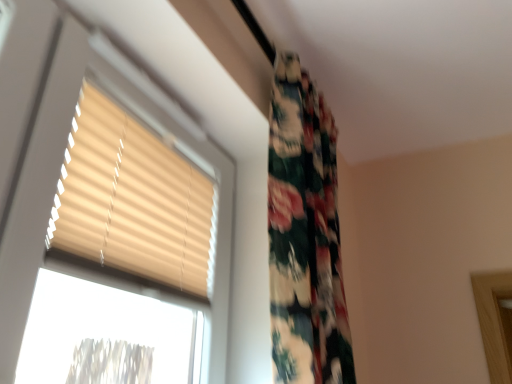
What do you see at coordinates (133, 200) in the screenshot? This screenshot has height=384, width=512. I see `beige wood blinds at upper left` at bounding box center [133, 200].

The height and width of the screenshot is (384, 512). Identify the location of beige wood blinds at upper left. (133, 200).

Where is `beige wood blinds at upper left`? This screenshot has width=512, height=384. beige wood blinds at upper left is located at coordinates (133, 200).